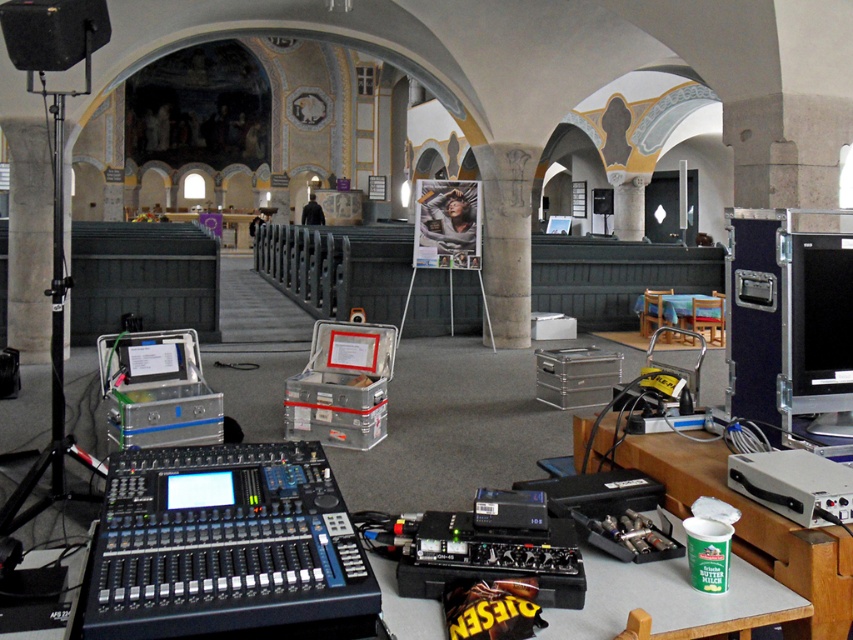
Does black plastic mixing console at center appear under black glossy monitor at right?

Yes, black plastic mixing console at center is below black glossy monitor at right.

Is point (184, 465) closer to viewer compared to point (790, 264)?

Yes.

This screenshot has width=853, height=640. Find the location of `black plastic mixing console at center`. black plastic mixing console at center is located at coordinates (225, 547).

Between metallic gray table at lower right and wooden table at center, which one appears on the left side from the viewer's perspective?

Positioned to the left is metallic gray table at lower right.

Is metallic gray table at lower right thinner than wooden table at center?

Indeed, metallic gray table at lower right has a lesser width compared to wooden table at center.

Is point (546, 632) less distant than point (693, 301)?

Yes, point (546, 632) is closer to viewer.

Locate an element on the screen. The width and height of the screenshot is (853, 640). metallic gray table at lower right is located at coordinates (671, 600).

Is black plastic mixing console at center shorter than wooden table at center?

Indeed, black plastic mixing console at center has a lesser height compared to wooden table at center.

Can you confirm if black plastic mixing console at center is wider than wooden table at center?

Incorrect, black plastic mixing console at center's width does not surpass wooden table at center's.

What do you see at coordinates (225, 547) in the screenshot?
I see `black plastic mixing console at center` at bounding box center [225, 547].

Image resolution: width=853 pixels, height=640 pixels. I want to click on black plastic mixing console at center, so click(225, 547).